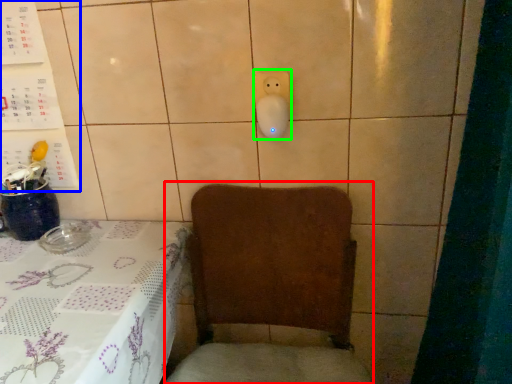
Question: Which is farther away from armchair (highlighted by a red box)? bulletin board (highlighted by a blue box) or electric outlet (highlighted by a green box)?

Choices:
 (A) bulletin board
 (B) electric outlet

Answer: (A)